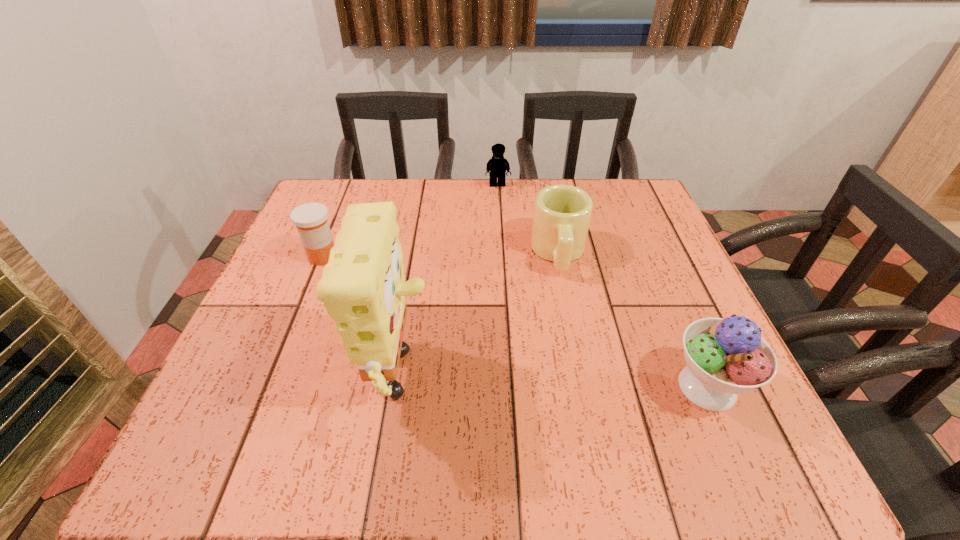
Identify the location of the second object from left to right. (363, 287).

Locate an element on the screen. sponge is located at coordinates (363, 287).

Identify the location of the rightmost object. (725, 357).

Identify the location of icecream. (725, 357).

Identify the location of the farthest object. (497, 165).

Find the location of a particular element. Lego is located at coordinates (497, 165).

In order to click on the leftmost object in this screenshot , I will do `click(311, 221)`.

The width and height of the screenshot is (960, 540). I want to click on mug, so click(x=562, y=213).

This screenshot has width=960, height=540. In order to click on free space located on the face of the sponge in this screenshot , I will do `click(617, 386)`.

Where is `vacant space located 0.330m on the left of the rightmost object`? vacant space located 0.330m on the left of the rightmost object is located at coordinates (478, 387).